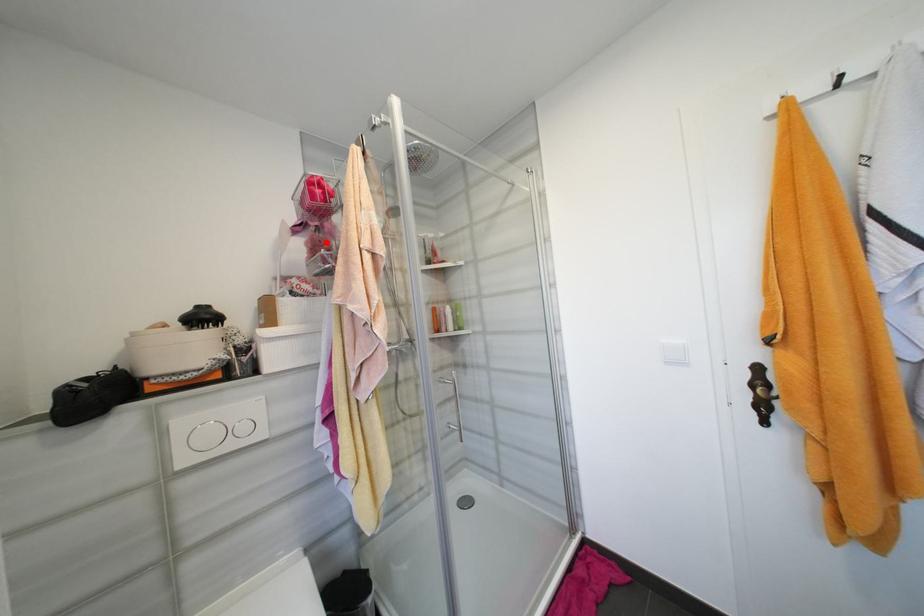
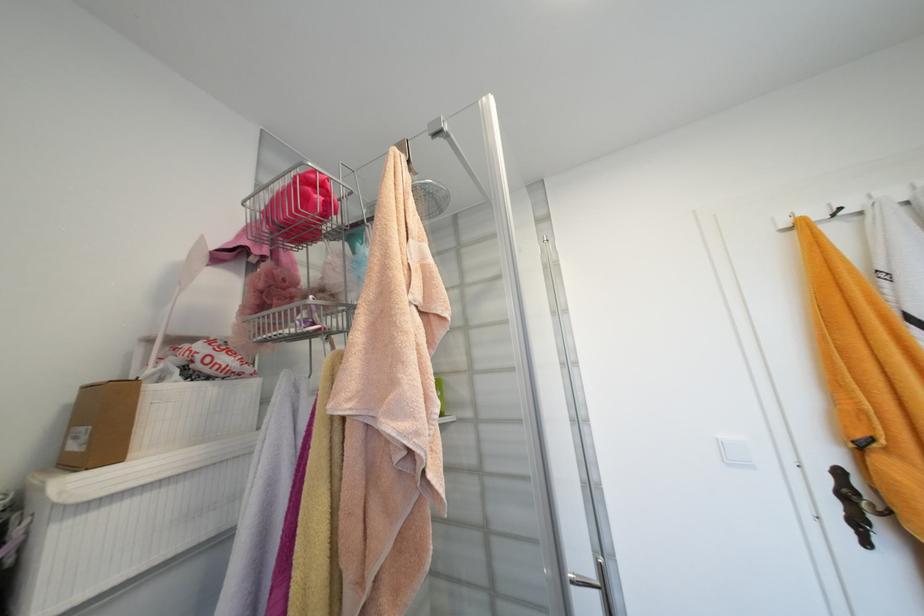
In the second image, find the point that corresponds to the highlighted location in the first image.

(289, 282)